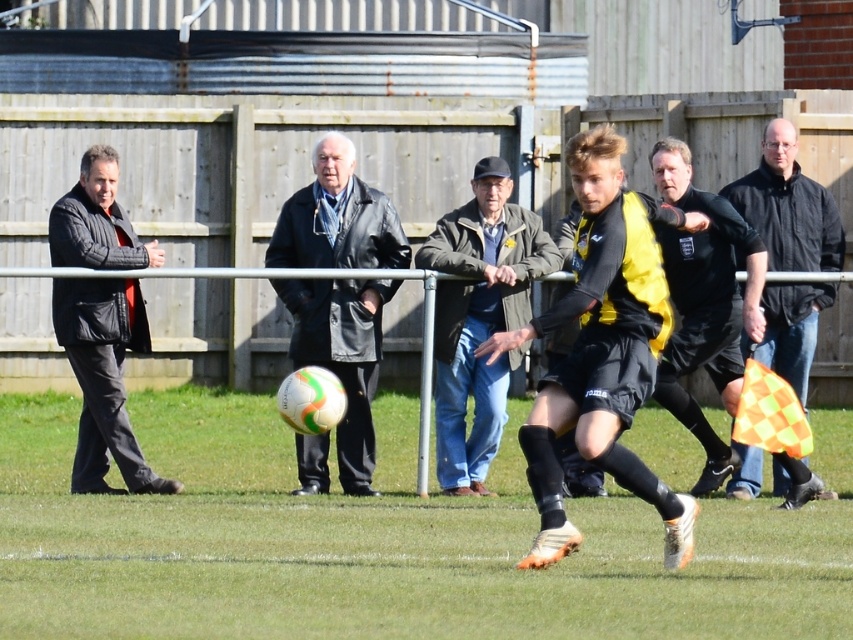
Which is behind, point (828, 600) or point (785, 186)?

Positioned behind is point (785, 186).

Is grass at center above black leather jacket at right?

No.

Does point (206, 604) lie in front of point (786, 333)?

Yes, point (206, 604) is in front of point (786, 333).

This screenshot has width=853, height=640. What are the coordinates of `grass at center` in the screenshot? It's located at (383, 541).

Who is more distant from viewer, (350, 412) or (115, 289)?

Positioned behind is point (350, 412).

Identify the location of leather jacket at center. (341, 356).

At what (x,y) coordinates should I click in order to perform the action: click on leather jacket at center. Please return your answer as a coordinate pair (x, y). The width and height of the screenshot is (853, 640). Looking at the image, I should click on (341, 356).

Does leather jacket at center have a greater height compared to black jersey at center?

Yes.

Can you confirm if leather jacket at center is thinner than black jersey at center?

In fact, leather jacket at center might be wider than black jersey at center.

Is point (294, 284) positioned behind point (759, 250)?

Yes, point (294, 284) is farther from viewer.

This screenshot has height=640, width=853. I want to click on leather jacket at center, so click(x=341, y=356).